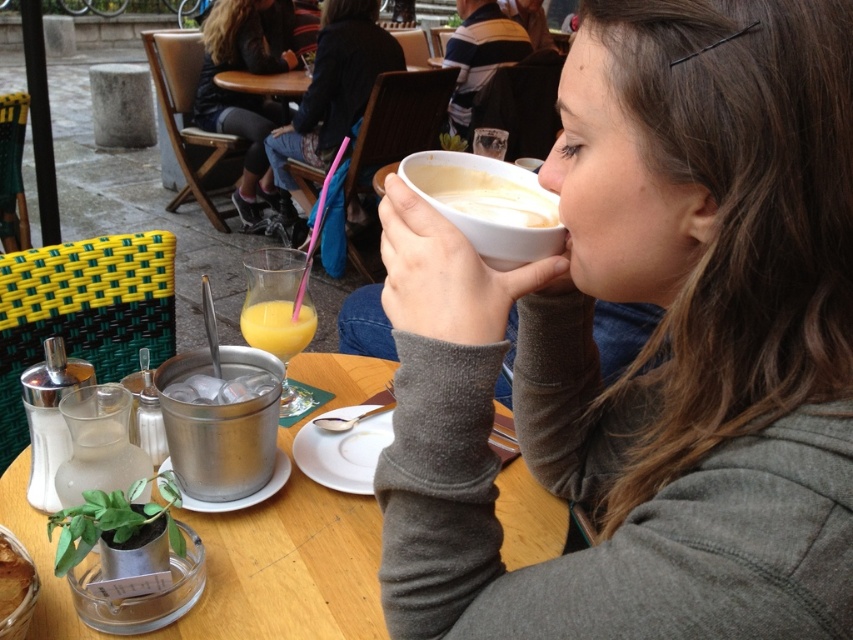
Question: Which point is farther to the camera?

Choices:
 (A) (253, 323)
 (B) (347, 497)
 (C) (247, 401)

Answer: (A)

Question: Which object is positioned farthest from the matte plastic cup at upper center?

Choices:
 (A) translucent glass juice at center
 (B) matte black jacket at upper center

Answer: (A)

Question: Which of these objects is positioned farthest from the white creamy latte at upper center?

Choices:
 (A) matte plastic cup at upper center
 (B) wooden table at center
 (C) translucent glass juice at center
 (D) white matte cup at upper center

Answer: (A)

Question: Can you confirm if shiny metallic ice bucket at lower left is thinner than translucent glass juice at center?

Choices:
 (A) yes
 (B) no

Answer: (B)

Question: Can you confirm if translucent glass juice at center is smaller than translucent glass bowl at lower left?

Choices:
 (A) yes
 (B) no

Answer: (B)

Question: Is matte black jacket at upper center behind translucent glass bowl at lower left?

Choices:
 (A) no
 (B) yes

Answer: (B)